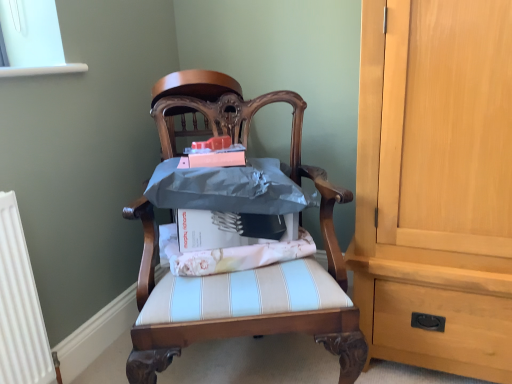
Where is `metallic blue cushion at center, the 1th chair in the top-to-bottom sequence`? metallic blue cushion at center, the 1th chair in the top-to-bottom sequence is located at coordinates [195, 86].

Are white striped fabric at center and wooden chair at center, which appears as the first chair when ordered from the bottom, beside each other?

No, white striped fabric at center is not with wooden chair at center, which appears as the first chair when ordered from the bottom.

Is white striped fabric at center further to camera compared to wooden chair at center, which is the second chair in top-to-bottom order?

Yes, it is.

Looking at this image, can you confirm if white striped fabric at center is shorter than wooden chair at center, which is the second chair in top-to-bottom order?

Yes.

Which is correct: white striped fabric at center is inside wooden chair at center, which appears as the first chair when ordered from the bottom, or outside of it?

white striped fabric at center is located inside wooden chair at center, which appears as the first chair when ordered from the bottom.

Is metallic blue cushion at center, the 1th chair in the top-to-bottom sequence, outside of wooden chair at center, which is the second chair in top-to-bottom order?

Yes, metallic blue cushion at center, the 1th chair in the top-to-bottom sequence, is not within wooden chair at center, which is the second chair in top-to-bottom order.

Is metallic blue cushion at center, the 1th chair in the top-to-bottom sequence, taller or shorter than wooden chair at center, which is the second chair in top-to-bottom order?

Considering their sizes, metallic blue cushion at center, the 1th chair in the top-to-bottom sequence, has less height than wooden chair at center, which is the second chair in top-to-bottom order.

This screenshot has height=384, width=512. What are the coordinates of `chair behind the wooden chair at center, which appears as the first chair when ordered from the bottom` in the screenshot? It's located at (195, 86).

Can you tell me how much metallic blue cushion at center, the 1th chair in the top-to-bottom sequence, and white striped fabric at center differ in facing direction?

5.45 degrees separate the facing orientations of metallic blue cushion at center, the 1th chair in the top-to-bottom sequence, and white striped fabric at center.

Does metallic blue cushion at center, which is the second chair from bottom to top, have a lesser width compared to white striped fabric at center?

In fact, metallic blue cushion at center, which is the second chair from bottom to top, might be wider than white striped fabric at center.

Between metallic blue cushion at center, the 1th chair in the top-to-bottom sequence, and white striped fabric at center, which one is positioned behind?

metallic blue cushion at center, the 1th chair in the top-to-bottom sequence, is more distant.

Is metallic blue cushion at center, the 1th chair in the top-to-bottom sequence, facing towards white striped fabric at center?

No, metallic blue cushion at center, the 1th chair in the top-to-bottom sequence, is not facing towards white striped fabric at center.

From the image's perspective, is white striped fabric at center beneath metallic blue cushion at center, which is the second chair from bottom to top?

Correct, white striped fabric at center appears lower than metallic blue cushion at center, which is the second chair from bottom to top, in the image.

In the image, is white striped fabric at center on the left side or the right side of metallic blue cushion at center, the 1th chair in the top-to-bottom sequence?

white striped fabric at center is positioned on metallic blue cushion at center, the 1th chair in the top-to-bottom sequence,'s right side.

Is white striped fabric at center directly adjacent to metallic blue cushion at center, which is the second chair from bottom to top?

They are not placed beside each other.

Is point (239, 265) positioned before point (229, 86)?

Yes, it is in front of point (229, 86).

Considering the positions of objects wooden chair at center, which is the second chair in top-to-bottom order, and metallic blue cushion at center, which is the second chair from bottom to top, in the image provided, who is more to the right, wooden chair at center, which is the second chair in top-to-bottom order, or metallic blue cushion at center, which is the second chair from bottom to top,?

wooden chair at center, which is the second chair in top-to-bottom order, is more to the right.

Is wooden chair at center, which is the second chair in top-to-bottom order, wider or thinner than metallic blue cushion at center, the 1th chair in the top-to-bottom sequence?

In the image, wooden chair at center, which is the second chair in top-to-bottom order, appears to be wider than metallic blue cushion at center, the 1th chair in the top-to-bottom sequence.

Based on the photo, can metallic blue cushion at center, which is the second chair from bottom to top, be found inside wooden chair at center, which appears as the first chair when ordered from the bottom?

No, metallic blue cushion at center, which is the second chair from bottom to top, is located outside of wooden chair at center, which appears as the first chair when ordered from the bottom.

This screenshot has height=384, width=512. I want to click on chair lying below the metallic blue cushion at center, the 1th chair in the top-to-bottom sequence (from the image's perspective), so click(245, 139).

From the image's perspective, is wooden chair at center, which is the second chair in top-to-bottom order, located beneath white striped fabric at center?

Indeed, from the image's perspective, wooden chair at center, which is the second chair in top-to-bottom order, is shown beneath white striped fabric at center.

At what (x,y) coordinates should I click in order to perform the action: click on chair in front of the white striped fabric at center. Please return your answer as a coordinate pair (x, y). This screenshot has width=512, height=384. Looking at the image, I should click on (245, 139).

From the picture: From a real-world perspective, between wooden chair at center, which is the second chair in top-to-bottom order, and white striped fabric at center, who is vertically lower?

wooden chair at center, which is the second chair in top-to-bottom order, from a real-world perspective.

Is wooden chair at center, which appears as the first chair when ordered from the bottom, next to white striped fabric at center and touching it?

wooden chair at center, which appears as the first chair when ordered from the bottom, is not next to white striped fabric at center, and they're not touching.

Find the location of a particular element. Image resolution: width=512 pixels, height=384 pixels. chair that is under the white striped fabric at center (from a real-world perspective) is located at coordinates (245, 139).

Identify the location of chair behind the wooden chair at center, which appears as the first chair when ordered from the bottom. This screenshot has height=384, width=512. (195, 86).

Which object lies nearer to the anchor point white striped fabric at center, metallic blue cushion at center, the 1th chair in the top-to-bottom sequence, or wooden chair at center, which appears as the first chair when ordered from the bottom?

wooden chair at center, which appears as the first chair when ordered from the bottom.

Estimate the real-world distances between objects in this image. Which object is further from metallic blue cushion at center, which is the second chair from bottom to top, white striped fabric at center or wooden chair at center, which is the second chair in top-to-bottom order?

white striped fabric at center lies further to metallic blue cushion at center, which is the second chair from bottom to top, than the other object.

Estimate the real-world distances between objects in this image. Which object is further from white striped fabric at center, wooden chair at center, which is the second chair in top-to-bottom order, or metallic blue cushion at center, the 1th chair in the top-to-bottom sequence?

metallic blue cushion at center, the 1th chair in the top-to-bottom sequence, is further to white striped fabric at center.

Estimate the real-world distances between objects in this image. Which object is further from metallic blue cushion at center, which is the second chair from bottom to top, wooden chair at center, which is the second chair in top-to-bottom order, or white striped fabric at center?

white striped fabric at center.

Based on their spatial positions, is metallic blue cushion at center, the 1th chair in the top-to-bottom sequence, or white striped fabric at center further from wooden chair at center, which is the second chair in top-to-bottom order?

Among the two, metallic blue cushion at center, the 1th chair in the top-to-bottom sequence, is located further to wooden chair at center, which is the second chair in top-to-bottom order.

Estimate the real-world distances between objects in this image. Which object is further from wooden chair at center, which is the second chair in top-to-bottom order, white striped fabric at center or metallic blue cushion at center, the 1th chair in the top-to-bottom sequence?

Based on the image, metallic blue cushion at center, the 1th chair in the top-to-bottom sequence, appears to be further to wooden chair at center, which is the second chair in top-to-bottom order.

Locate an element on the screen. Image resolution: width=512 pixels, height=384 pixels. fabric between metallic blue cushion at center, which is the second chair from bottom to top, and wooden chair at center, which appears as the first chair when ordered from the bottom, vertically is located at coordinates (229, 254).